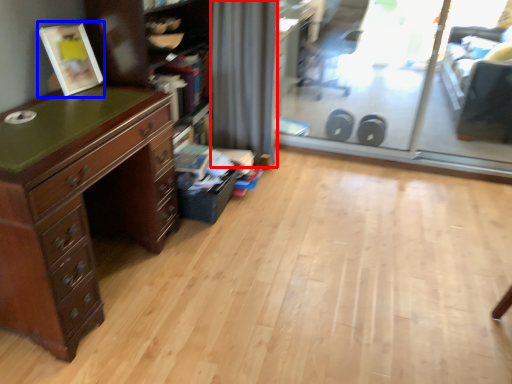
Question: Which object appears closest to the camera in this image, curtain (highlighted by a red box) or picture frame (highlighted by a blue box)?

Choices:
 (A) curtain
 (B) picture frame

Answer: (B)